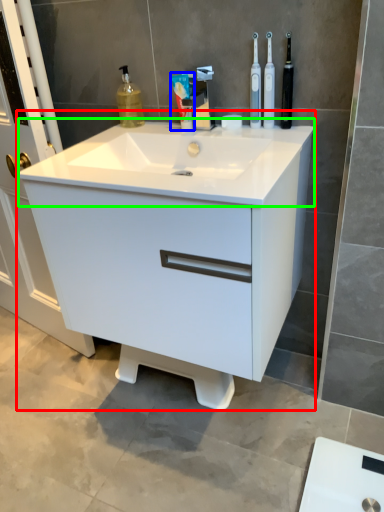
Question: Which object is the farthest from bathroom cabinet (highlighted by a red box)? Choose among these: toothpaste (highlighted by a blue box) or counter top (highlighted by a green box).

Choices:
 (A) toothpaste
 (B) counter top

Answer: (A)